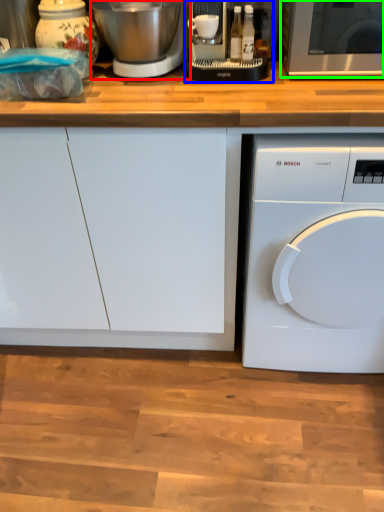
Question: Which object is the closest to the mixer (highlighted by a red box)? Choose among these: food processor (highlighted by a blue box) or microwave oven (highlighted by a green box).

Choices:
 (A) food processor
 (B) microwave oven

Answer: (A)